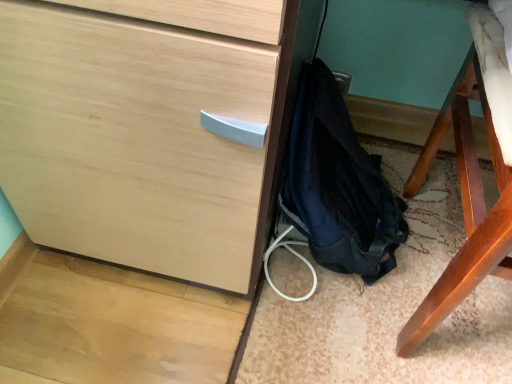
This screenshot has height=384, width=512. Find the location of `vacant space that is to the left of dark blue fabric backpack at lower right`. vacant space that is to the left of dark blue fabric backpack at lower right is located at coordinates [x=216, y=312].